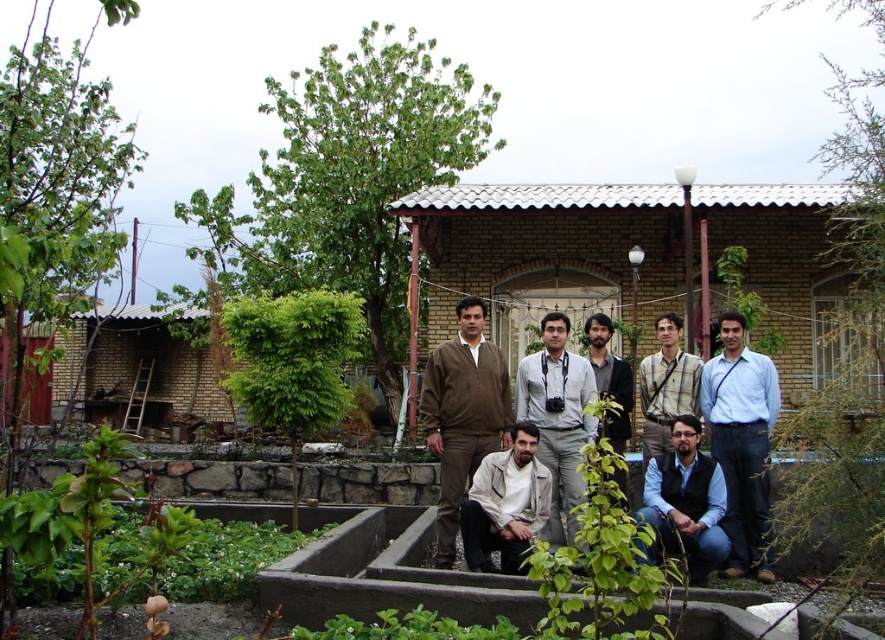
Question: Which is nearer to the dark brown sweater at center?

Choices:
 (A) light blue shirt at center
 (B) light beige fabric shirt at lower center
 (C) brown matte sweater at center
 (D) light gray fabric shirt at center

Answer: (D)

Question: Based on their relative distances, which object is nearer to the light brown shirt at center?

Choices:
 (A) light blue shirt at center
 (B) dark blue jeans at lower center
 (C) light beige fabric shirt at lower center
 (D) brown matte sweater at center

Answer: (A)

Question: Does dark blue jeans at lower center have a larger size compared to light brown shirt at center?

Choices:
 (A) no
 (B) yes

Answer: (B)

Question: Considering the real-world distances, which object is closest to the light brown shirt at center?

Choices:
 (A) dark brown sweater at center
 (B) light gray fabric shirt at center
 (C) light beige fabric shirt at lower center
 (D) brown matte sweater at center

Answer: (A)

Question: Can you confirm if light gray fabric shirt at center is positioned above light beige fabric shirt at lower center?

Choices:
 (A) no
 (B) yes

Answer: (B)

Question: Observing the image, what is the correct spatial positioning of light brown shirt at center in reference to dark brown sweater at center?

Choices:
 (A) right
 (B) left

Answer: (A)